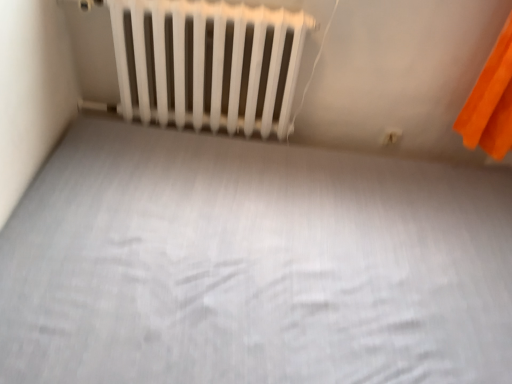
Question: Considering the positions of white matte bed frame at center and white plastic electric outlet at upper right in the image, is white matte bed frame at center bigger or smaller than white plastic electric outlet at upper right?

Choices:
 (A) small
 (B) big

Answer: (B)

Question: From the image's perspective, is white matte bed frame at center located above or below white plastic electric outlet at upper right?

Choices:
 (A) above
 (B) below

Answer: (B)

Question: Estimate the real-world distances between objects in this image. Which object is farther from the white plastic electric outlet at upper right?

Choices:
 (A) white matte bed frame at center
 (B) white matte radiator at upper center

Answer: (A)

Question: Which object is the farthest from the white matte radiator at upper center?

Choices:
 (A) white matte bed frame at center
 (B) white plastic electric outlet at upper right

Answer: (B)